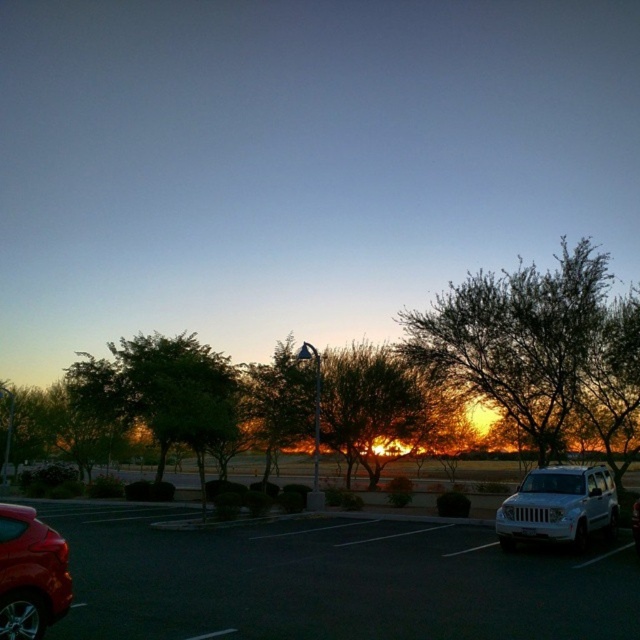
Is point (20, 566) closer to viewer compared to point (634, 500)?

Yes, it is.

Is shiny red car at lower left thinner than white matte suv at right?

Yes, shiny red car at lower left is thinner than white matte suv at right.

Is point (8, 536) positioned behind point (632, 522)?

No, (8, 536) is in front of (632, 522).

Locate an element on the screen. This screenshot has height=640, width=640. shiny red car at lower left is located at coordinates (29, 573).

How much distance is there between metallic silver car at lower right and white matte suv at right?

metallic silver car at lower right is 7.81 meters away from white matte suv at right.

Between metallic silver car at lower right and white matte suv at right, which one has less height?

With less height is white matte suv at right.

Between point (266, 611) and point (637, 547), which one is positioned behind?

Positioned behind is point (637, 547).

Locate an element on the screen. metallic silver car at lower right is located at coordinates (330, 580).

Is point (611, 372) behind point (131, 378)?

No, (611, 372) is closer to viewer.

This screenshot has width=640, height=640. In order to click on green leafy tree at upper right in this screenshot , I will do `click(538, 348)`.

Locate an element on the screen. The height and width of the screenshot is (640, 640). green leafy tree at upper right is located at coordinates (538, 348).